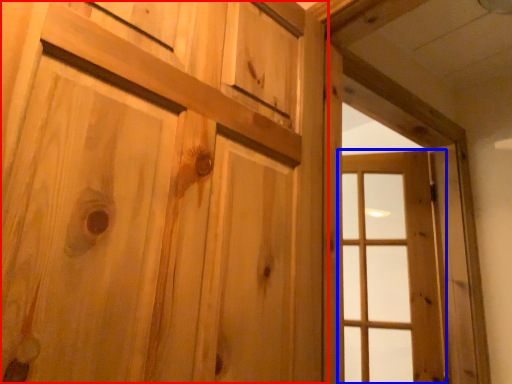
Question: Among these objects, which one is nearest to the camera, door (highlighted by a red box) or window (highlighted by a blue box)?

Choices:
 (A) door
 (B) window

Answer: (A)